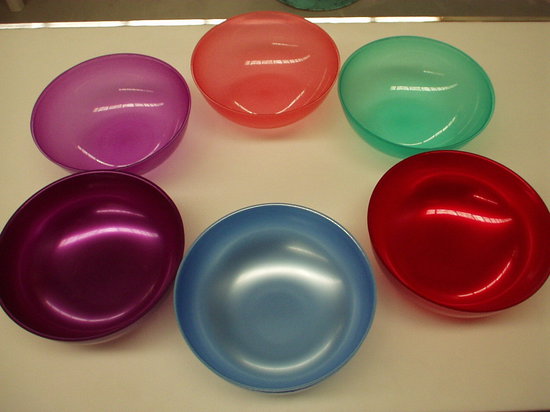
Where is `floor`? floor is located at coordinates (102, 9), (410, 7).